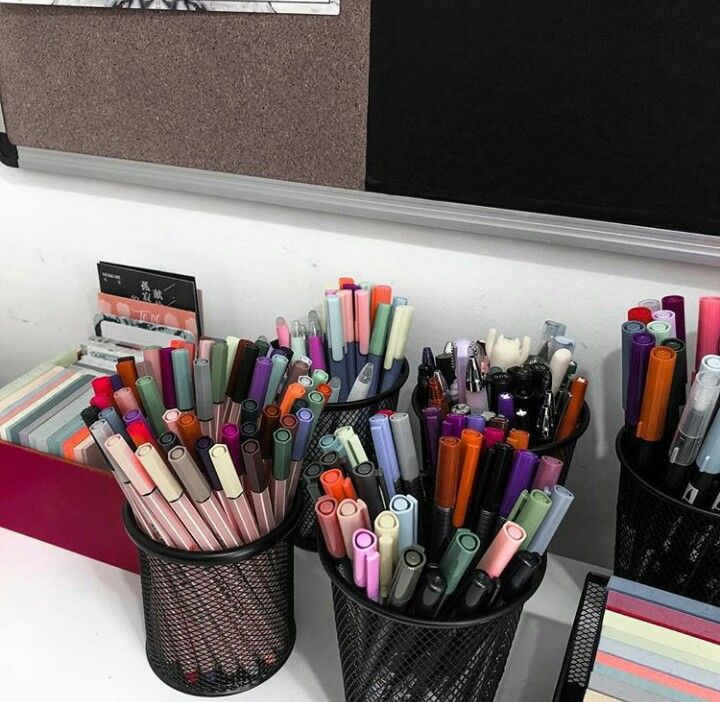
Where is `wall`? The width and height of the screenshot is (720, 702). wall is located at coordinates (287, 265).